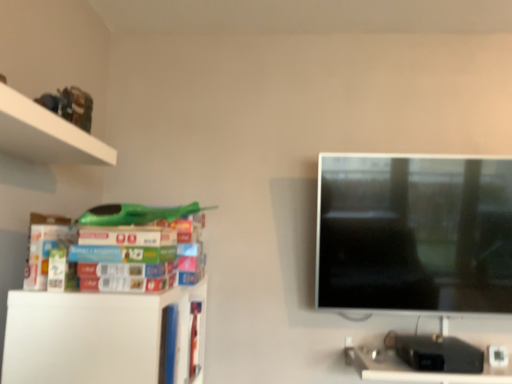
Question: Can you confirm if matte plastic books at left is thinner than black plastic computer desk at lower right?

Choices:
 (A) yes
 (B) no

Answer: (A)

Question: Is black plastic computer desk at lower right located within matte plastic books at left?

Choices:
 (A) no
 (B) yes

Answer: (A)

Question: Is matte plastic books at left taller than black plastic computer desk at lower right?

Choices:
 (A) yes
 (B) no

Answer: (A)

Question: Can you confirm if matte plastic books at left is smaller than black plastic computer desk at lower right?

Choices:
 (A) yes
 (B) no

Answer: (A)

Question: From a real-world perspective, is matte plastic books at left over black plastic computer desk at lower right?

Choices:
 (A) no
 (B) yes

Answer: (B)

Question: Considering the relative sizes of matte plastic books at left and black plastic computer desk at lower right in the image provided, is matte plastic books at left shorter than black plastic computer desk at lower right?

Choices:
 (A) no
 (B) yes

Answer: (A)

Question: Does black plastic computer desk at lower right appear on the left side of matte plastic books at left?

Choices:
 (A) no
 (B) yes

Answer: (A)

Question: Is matte plastic books at left a part of black plastic computer desk at lower right?

Choices:
 (A) yes
 (B) no

Answer: (B)

Question: Is black plastic computer desk at lower right placed right next to matte plastic books at left?

Choices:
 (A) no
 (B) yes

Answer: (A)

Question: From the image's perspective, would you say black plastic computer desk at lower right is positioned over matte plastic books at left?

Choices:
 (A) yes
 (B) no

Answer: (B)

Question: Does black plastic computer desk at lower right have a greater height compared to matte plastic books at left?

Choices:
 (A) yes
 (B) no

Answer: (B)

Question: Is black plastic computer desk at lower right turned away from matte plastic books at left?

Choices:
 (A) yes
 (B) no

Answer: (B)

Question: Considering the relative positions of matte plastic books at left and white matte shelf at lower left in the image provided, is matte plastic books at left to the right of white matte shelf at lower left from the viewer's perspective?

Choices:
 (A) yes
 (B) no

Answer: (A)